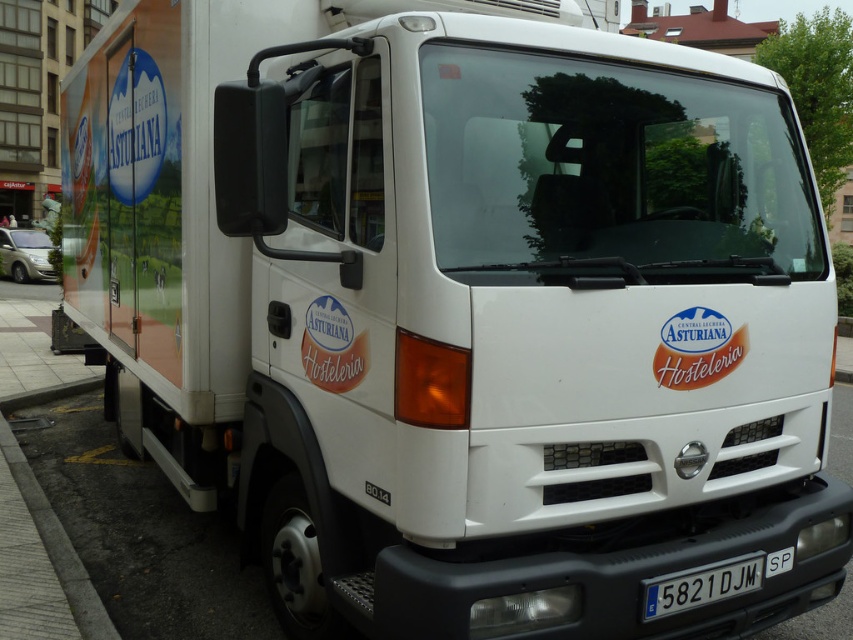
Question: Is gray concrete curb at lower left positioned before black plastic license plate at bottom center?

Choices:
 (A) no
 (B) yes

Answer: (A)

Question: Which of the following is the closest to the observer?

Choices:
 (A) (24, 232)
 (B) (732, 579)
 (C) (77, 595)

Answer: (B)

Question: Does gray concrete curb at lower left appear under matte silver van at left?

Choices:
 (A) no
 (B) yes

Answer: (B)

Question: Based on their relative distances, which object is nearer to the black plastic license plate at bottom center?

Choices:
 (A) gray concrete curb at lower left
 (B) matte silver van at left

Answer: (A)

Question: Which object appears closest to the camera in this image?

Choices:
 (A) gray concrete curb at lower left
 (B) black plastic license plate at bottom center
 (C) matte silver van at left

Answer: (B)

Question: From the image, what is the correct spatial relationship of gray concrete curb at lower left in relation to matte silver van at left?

Choices:
 (A) left
 (B) right

Answer: (B)